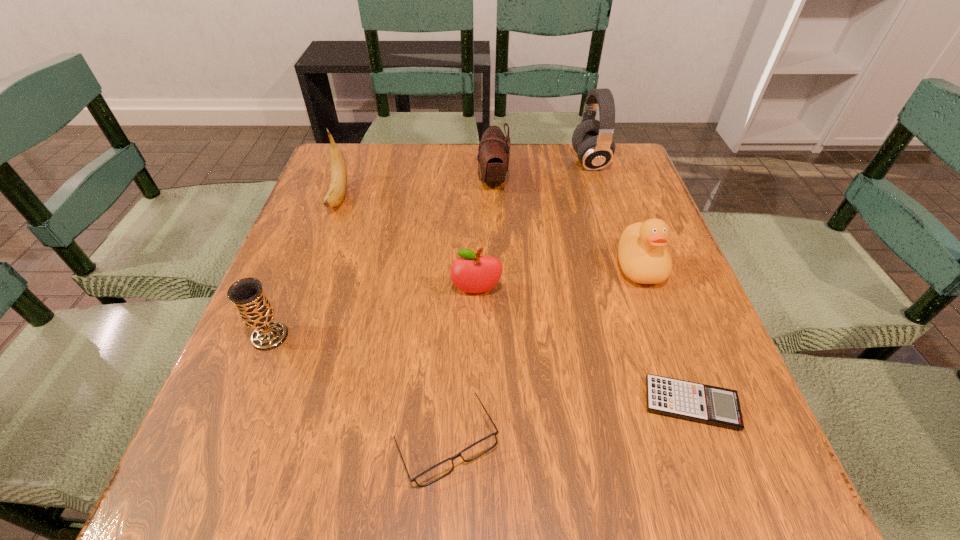
Where is `headset`? This screenshot has height=540, width=960. headset is located at coordinates (592, 140).

Locate an element on the screen. This screenshot has width=960, height=540. banana is located at coordinates (337, 189).

The height and width of the screenshot is (540, 960). I want to click on pouch, so click(x=493, y=155).

Find the location of a particular element. duck is located at coordinates (643, 258).

Where is `the third nearest object`? the third nearest object is located at coordinates (255, 310).

I want to click on apple, so click(x=472, y=273).

Locate an element on the screen. The height and width of the screenshot is (540, 960). spectacles is located at coordinates (477, 449).

Find the location of a particular element. The width and height of the screenshot is (960, 540). calculator is located at coordinates (708, 404).

Where is `vacant space located on the ear cups of the headset`? The width and height of the screenshot is (960, 540). vacant space located on the ear cups of the headset is located at coordinates (495, 161).

Locate an element on the screen. vacant space located 0.230m on the ear cups of the headset is located at coordinates (488, 161).